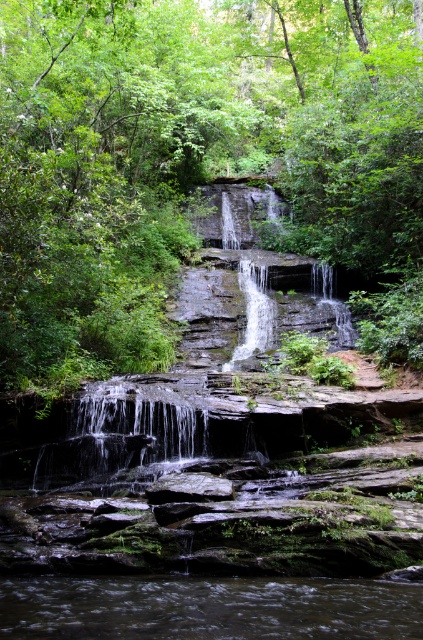
Question: Can you confirm if green leafy tree at center is positioned to the right of gray rough rock at center?

Choices:
 (A) yes
 (B) no

Answer: (A)

Question: Which object appears farthest from the camera in this image?

Choices:
 (A) brown/muddy water at lower center
 (B) smooth gray rock waterfall at center
 (C) gray rough rock at center
 (D) green leafy tree at center

Answer: (B)

Question: Can you confirm if brown/muddy water at lower center is thinner than gray rough rock at center?

Choices:
 (A) yes
 (B) no

Answer: (B)

Question: Estimate the real-world distances between objects in this image. Which object is closer to the gray rough rock at center?

Choices:
 (A) brown/muddy water at lower center
 (B) green leafy tree at center
 (C) smooth gray rock waterfall at center

Answer: (A)

Question: Is smooth gray rock waterfall at center to the right of gray rough rock at center from the viewer's perspective?

Choices:
 (A) no
 (B) yes

Answer: (B)

Question: Estimate the real-world distances between objects in this image. Which object is closer to the brown/muddy water at lower center?

Choices:
 (A) green leafy tree at center
 (B) gray rough rock at center

Answer: (B)